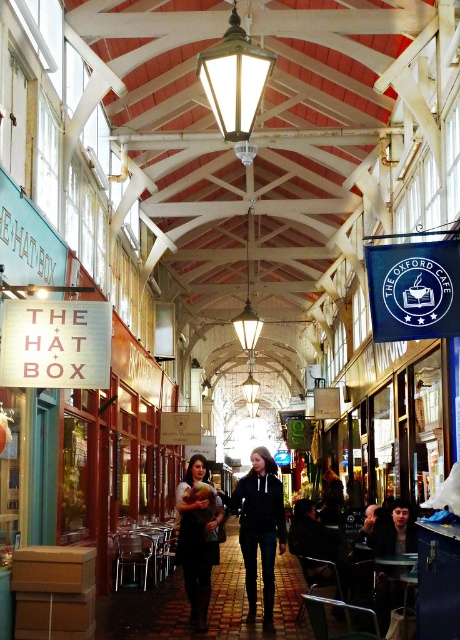
Which is behind, point (262, 483) or point (197, 524)?

Point (262, 483)

Is point (262, 552) positioned behind point (195, 461)?

No, (262, 552) is closer to viewer.

This screenshot has width=460, height=640. What do you see at coordinates (259, 528) in the screenshot? I see `black hoodie at center` at bounding box center [259, 528].

At what (x,y) coordinates should I click in order to perform the action: click on black hoodie at center. Please return your answer as a coordinate pair (x, y). Looking at the image, I should click on (259, 528).